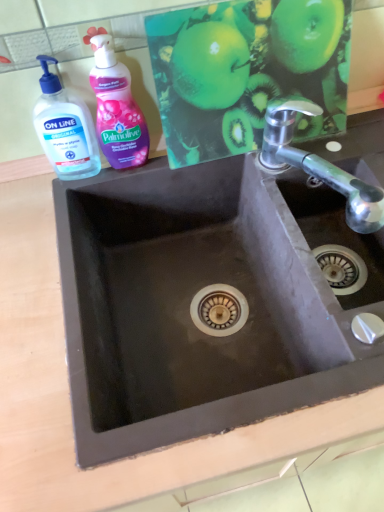
Question: Is transparent plastic hand soap at upper left positioned with its back to green matte apple at upper center?

Choices:
 (A) yes
 (B) no

Answer: (B)

Question: From the image's perspective, is transparent plastic hand soap at upper left below green matte apple at upper center?

Choices:
 (A) no
 (B) yes

Answer: (B)

Question: Does transparent plastic hand soap at upper left have a greater width compared to green matte apple at upper center?

Choices:
 (A) yes
 (B) no

Answer: (A)

Question: From a real-world perspective, is transparent plastic hand soap at upper left under green matte apple at upper center?

Choices:
 (A) no
 (B) yes

Answer: (B)

Question: Does transparent plastic hand soap at upper left come in front of green matte apple at upper center?

Choices:
 (A) yes
 (B) no

Answer: (B)

Question: Visually, is pink glossy liquid soap at upper left positioned to the left or to the right of black matte sink at center?

Choices:
 (A) right
 (B) left

Answer: (B)

Question: In terms of width, does pink glossy liquid soap at upper left look wider or thinner when compared to black matte sink at center?

Choices:
 (A) wide
 (B) thin

Answer: (B)

Question: Relative to black matte sink at center, is pink glossy liquid soap at upper left in front or behind?

Choices:
 (A) behind
 (B) front

Answer: (A)

Question: From a real-world perspective, is pink glossy liquid soap at upper left above or below black matte sink at center?

Choices:
 (A) below
 (B) above

Answer: (B)

Question: Considering the positions of black matte sink at center and transparent plastic hand soap at upper left in the image, is black matte sink at center taller or shorter than transparent plastic hand soap at upper left?

Choices:
 (A) short
 (B) tall

Answer: (B)

Question: From the image's perspective, is black matte sink at center positioned above or below transparent plastic hand soap at upper left?

Choices:
 (A) above
 (B) below

Answer: (B)

Question: Would you say black matte sink at center is inside or outside transparent plastic hand soap at upper left?

Choices:
 (A) outside
 (B) inside

Answer: (A)

Question: Is black matte sink at center to the left or to the right of transparent plastic hand soap at upper left in the image?

Choices:
 (A) right
 (B) left

Answer: (A)

Question: Is polished chrome tap at upper right wider or thinner than pink glossy liquid soap at upper left?

Choices:
 (A) wide
 (B) thin

Answer: (A)

Question: From a real-world perspective, is polished chrome tap at upper right positioned above or below pink glossy liquid soap at upper left?

Choices:
 (A) below
 (B) above

Answer: (A)